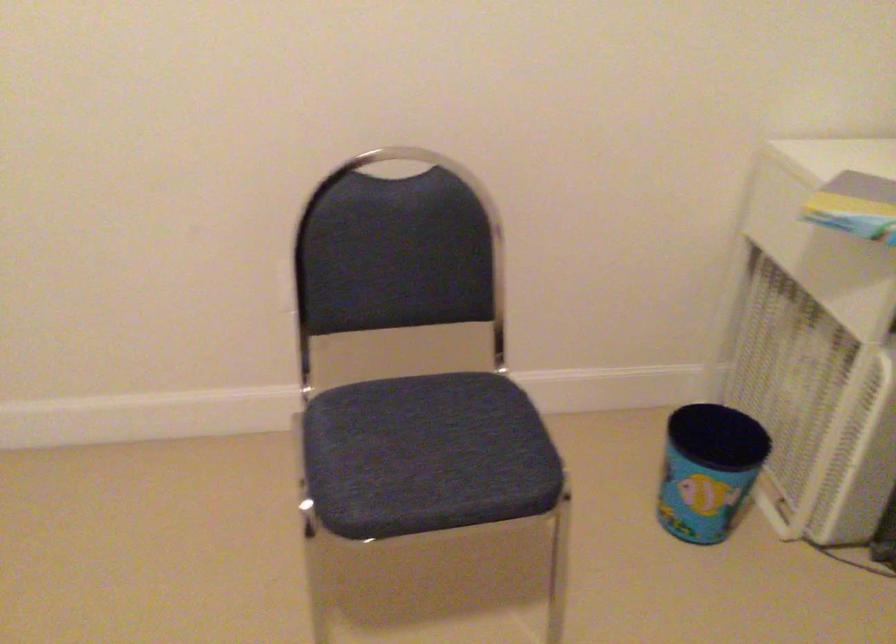
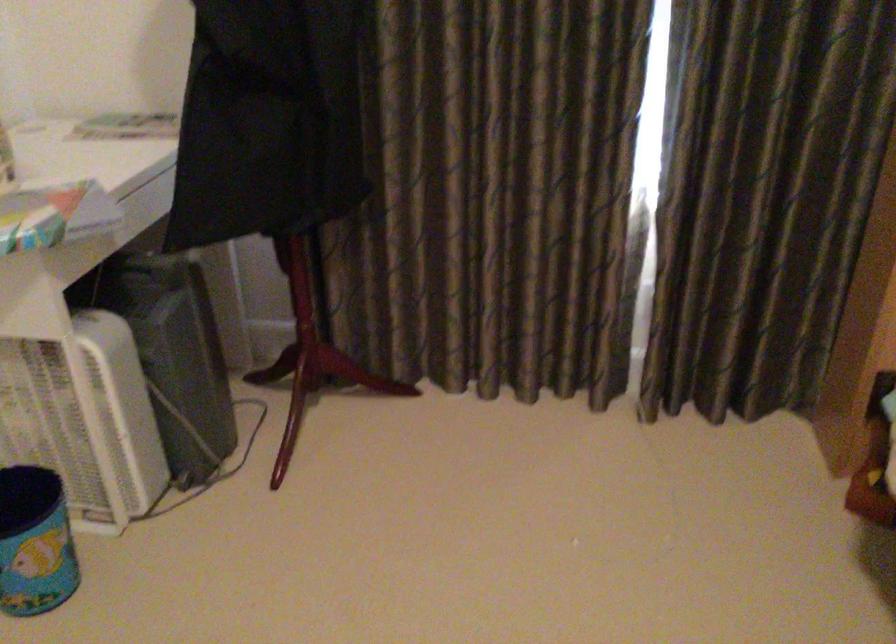
The point at (x=703, y=480) is marked in the first image. Where is the corresponding point in the second image?

(35, 542)